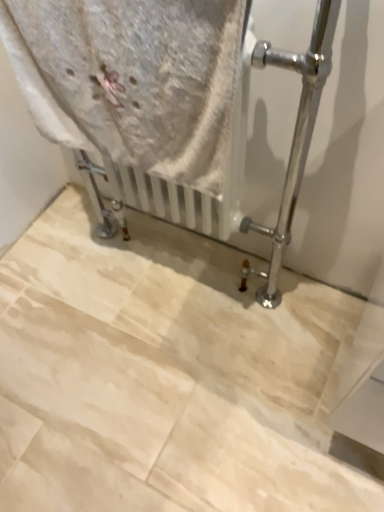
The width and height of the screenshot is (384, 512). What do you see at coordinates (132, 79) in the screenshot?
I see `white textured towel at upper center` at bounding box center [132, 79].

I want to click on white textured towel at upper center, so click(x=132, y=79).

At what (x,y) coordinates should I click in order to perform the action: click on white textured towel at upper center. Please return your answer as a coordinate pair (x, y). This screenshot has width=384, height=512. Looking at the image, I should click on (132, 79).